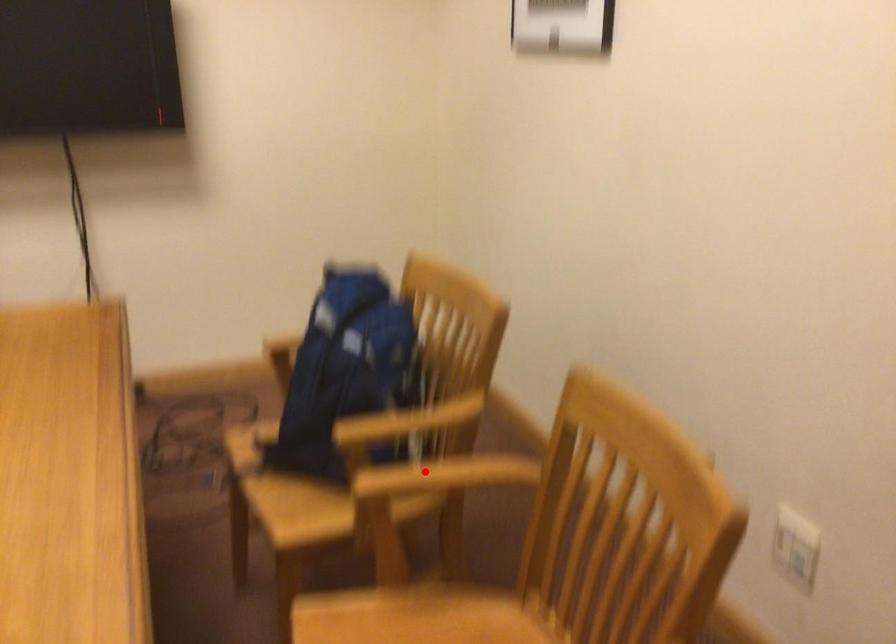
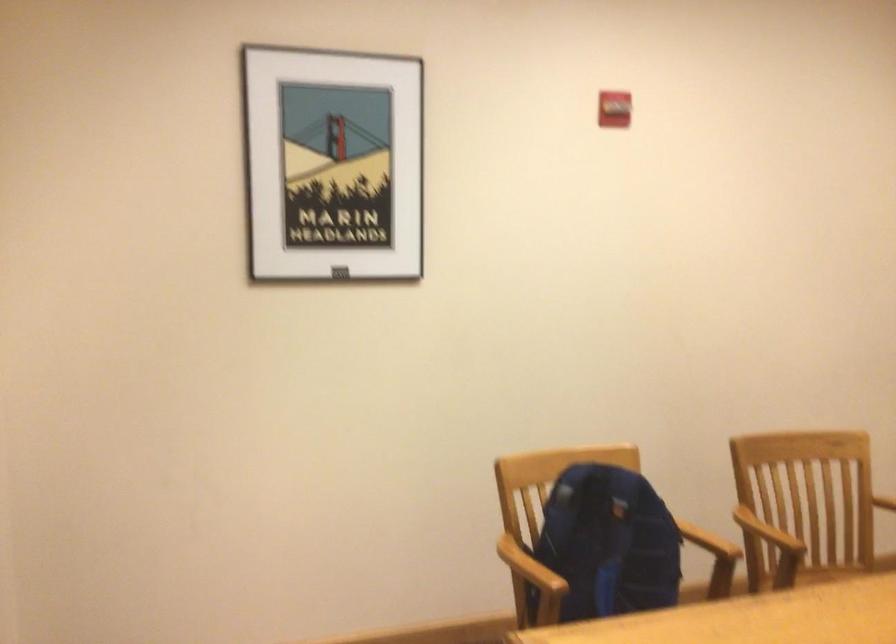
Question: I am providing you with two images of the same scene from different viewpoints. A red point is shown in image1. For the corresponding object point in image2, is it positioned nearer or farther from the camera?

Choices:
 (A) Nearer
 (B) Farther

Answer: (B)